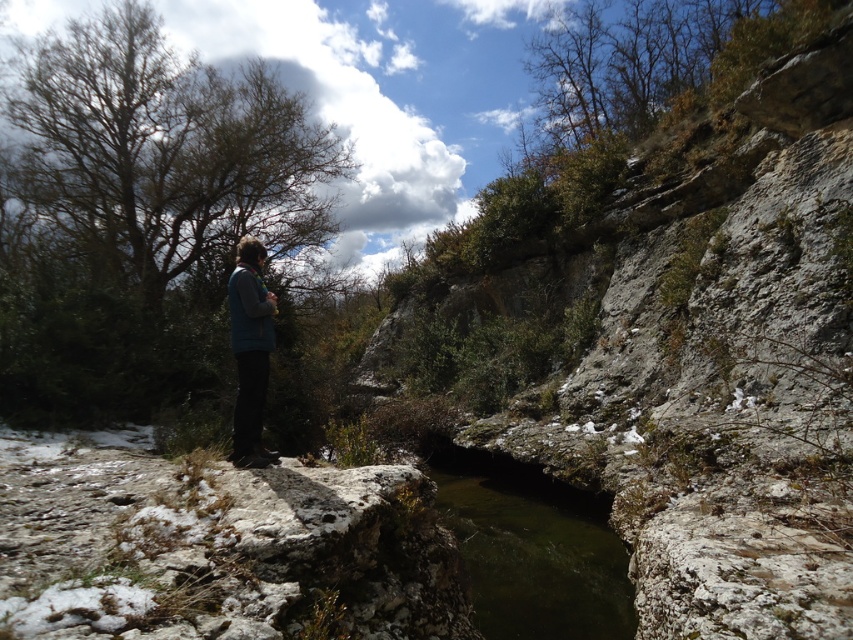
Is point (566, 513) behind point (253, 420)?

Yes, it is behind point (253, 420).

This screenshot has width=853, height=640. Find the location of `greenish rock at center`. greenish rock at center is located at coordinates (532, 548).

Identify the location of greenish rock at center. This screenshot has height=640, width=853. (532, 548).

Can you confirm if snowy rock at lower left is shorter than greenish rock at center?

Incorrect, snowy rock at lower left's height does not fall short of greenish rock at center's.

Can you confirm if snowy rock at lower left is wider than greenish rock at center?

Yes.

Describe the element at coordinates (216, 547) in the screenshot. I see `snowy rock at lower left` at that location.

Identify the location of snowy rock at lower left. This screenshot has width=853, height=640. (216, 547).

Between rough stone hillside at center and snowy rock at lower left, which one has more height?

rough stone hillside at center is taller.

Can you confirm if rough stone hillside at center is shorter than snowy rock at lower left?

Incorrect, rough stone hillside at center's height does not fall short of snowy rock at lower left's.

Measure the distance between point (610, 314) and camera.

Point (610, 314) and camera are 9.38 meters apart from each other.

The height and width of the screenshot is (640, 853). What are the coordinates of `rough stone hillside at center` in the screenshot? It's located at (703, 344).